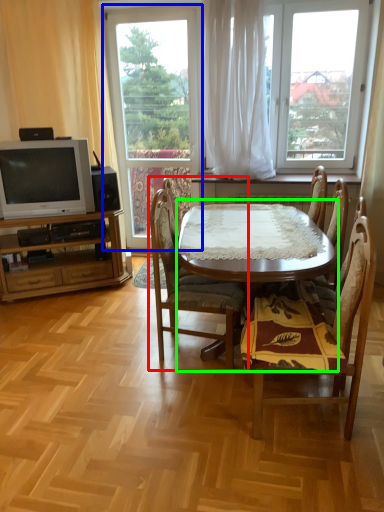
Question: Estimate the real-world distances between objects in this image. Which object is farther from chair (highlighted by a red box), window (highlighted by a blue box) or round table (highlighted by a green box)?

Choices:
 (A) window
 (B) round table

Answer: (A)